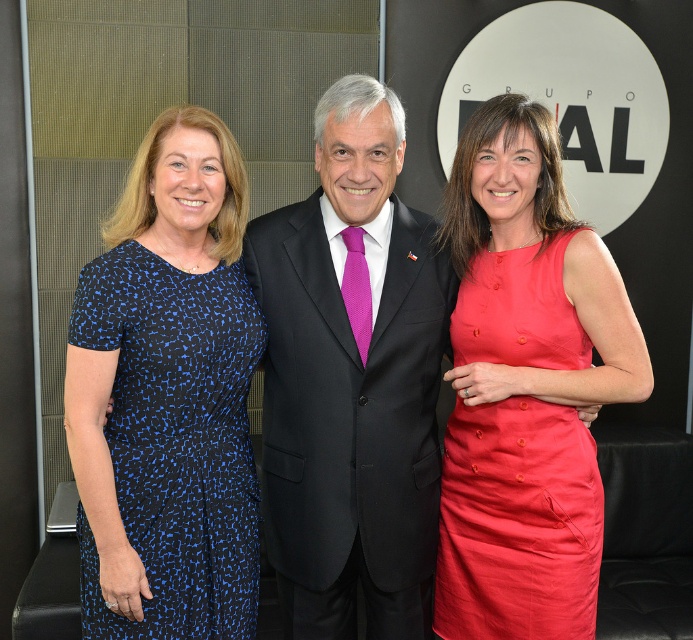
Question: Which point is farther to the camera?

Choices:
 (A) blue printed fabric dress at left
 (B) black suit at center
 (C) matte red dress at right

Answer: (C)

Question: Which of the following is the farthest from the observer?

Choices:
 (A) (344, 566)
 (B) (561, 308)
 (C) (177, 481)

Answer: (A)

Question: Is black suit at center thinner than blue printed fabric dress at left?

Choices:
 (A) yes
 (B) no

Answer: (B)

Question: Is black suit at center wider than matte red dress at right?

Choices:
 (A) no
 (B) yes

Answer: (B)

Question: Which is farther from the blue printed fabric dress at left?

Choices:
 (A) matte red dress at right
 (B) black suit at center

Answer: (A)

Question: Does black suit at center lie behind blue printed fabric dress at left?

Choices:
 (A) yes
 (B) no

Answer: (A)